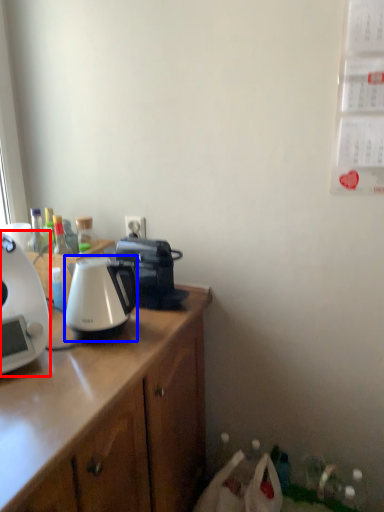
Question: Which point is further to the camera, coffee maker (highlighted by a red box) or kettle (highlighted by a blue box)?

Choices:
 (A) coffee maker
 (B) kettle

Answer: (B)